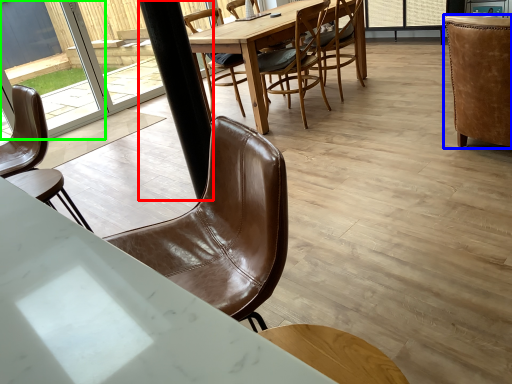
Question: Which is farther away from pole (highlighted by a red box)? chair (highlighted by a blue box) or glass door (highlighted by a green box)?

Choices:
 (A) chair
 (B) glass door

Answer: (B)